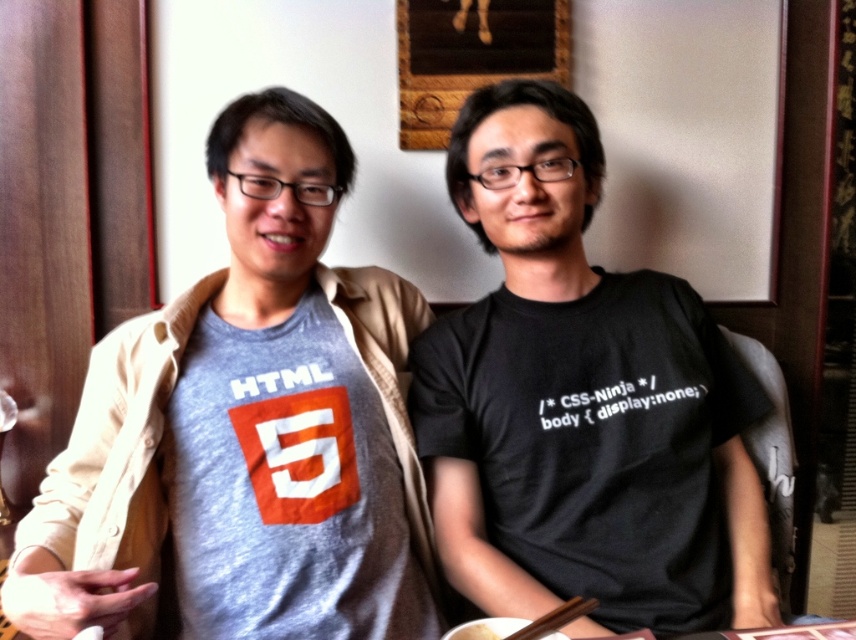
Consider the image. Can you confirm if gray cotton t-shirt at center is positioned to the right of brown wooden chopsticks at lower center?

No, gray cotton t-shirt at center is not to the right of brown wooden chopsticks at lower center.

Who is more distant from viewer, (248, 93) or (548, 616)?

The point (248, 93) is more distant.

Is point (325, 508) behind point (563, 611)?

That is True.

This screenshot has height=640, width=856. What are the coordinates of `gray cotton t-shirt at center` in the screenshot? It's located at (248, 426).

Who is more distant from viewer, (572, 604) or (480, 620)?

The point (572, 604) is more distant.

From the picture: Does brown wooden chopsticks at lower center come behind white crispy bread at lower center?

No, it is in front of white crispy bread at lower center.

Who is more forward, (566, 608) or (480, 625)?

Point (566, 608) is in front.

The width and height of the screenshot is (856, 640). I want to click on brown wooden chopsticks at lower center, so tap(556, 618).

Does point (438, 520) lie in front of point (467, 621)?

No, it is behind (467, 621).

Between point (717, 531) and point (476, 627), which one is positioned in front?

Point (476, 627)

The height and width of the screenshot is (640, 856). What do you see at coordinates (581, 403) in the screenshot?
I see `black matte t-shirt at center` at bounding box center [581, 403].

You are a GUI agent. You are given a task and a screenshot of the screen. Output one action in this format:
    pyautogui.click(x=<x>, y=<y>)
    Task: Click on the black matte t-shirt at center
    This screenshot has height=640, width=856.
    Given the screenshot: What is the action you would take?
    pyautogui.click(x=581, y=403)